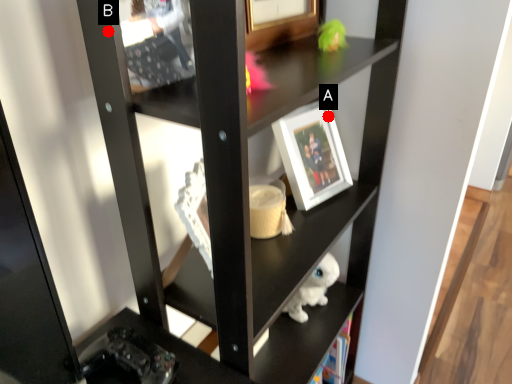
Question: Two points are circled on the image, labeled by A and B beside each circle. Which point is closer to the camera?

Choices:
 (A) A is closer
 (B) B is closer

Answer: (B)